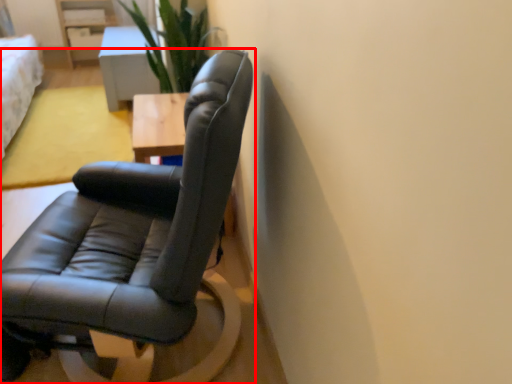
Question: From the image's perspective, what is the correct spatial relationship of chair (annotated by the red box) in relation to table?

Choices:
 (A) below
 (B) above

Answer: (A)